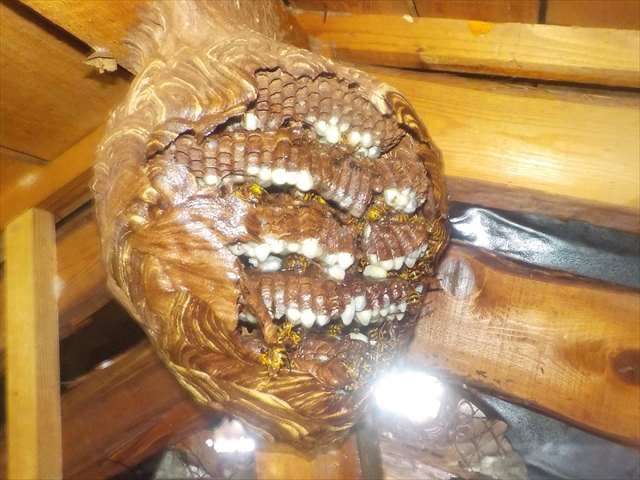
At what (x,y) coordinates should I click in order to perform the action: click on ceiling. Please return your answer as a coordinate pair (x, y). Image resolution: width=640 pixels, height=480 pixels. Looking at the image, I should click on (395, 16).